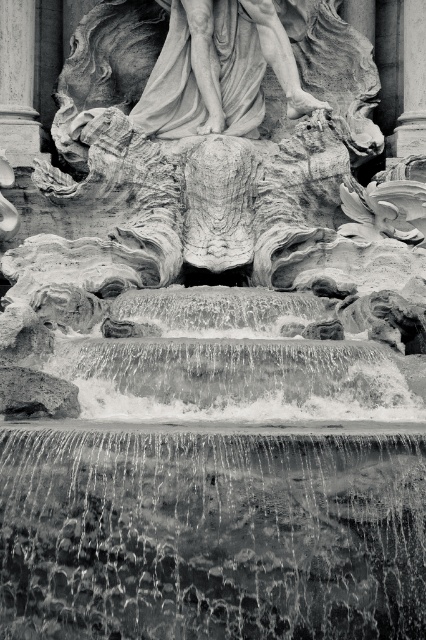
Question: Does translucent water at center come behind smooth stone pillar at left?

Choices:
 (A) no
 (B) yes

Answer: (A)

Question: Can you confirm if translucent water at center is thinner than smooth stone pillar at upper right?

Choices:
 (A) yes
 (B) no

Answer: (B)

Question: Which point is farther from the camera taking this photo?

Choices:
 (A) (69, 541)
 (B) (417, 113)
 (C) (14, 156)

Answer: (B)

Question: Can you confirm if translucent water at center is positioned to the left of smooth stone pillar at upper right?

Choices:
 (A) no
 (B) yes

Answer: (B)

Question: Which is farther from the smooth stone pillar at left?

Choices:
 (A) translucent water at center
 (B) smooth stone pillar at upper right

Answer: (A)

Question: Based on their relative distances, which object is nearer to the translucent water at center?

Choices:
 (A) smooth stone pillar at left
 (B) smooth stone pillar at upper right

Answer: (A)